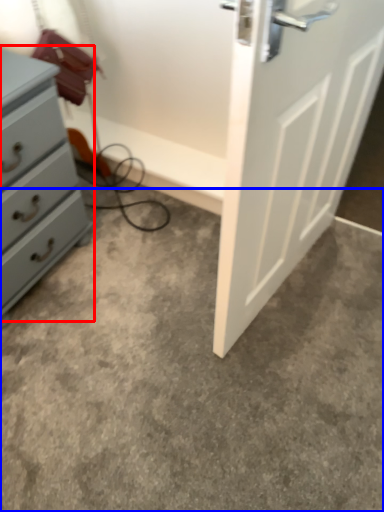
Question: Among these objects, which one is farthest to the camera, chest of drawers (highlighted by a red box) or concrete (highlighted by a blue box)?

Choices:
 (A) chest of drawers
 (B) concrete

Answer: (A)